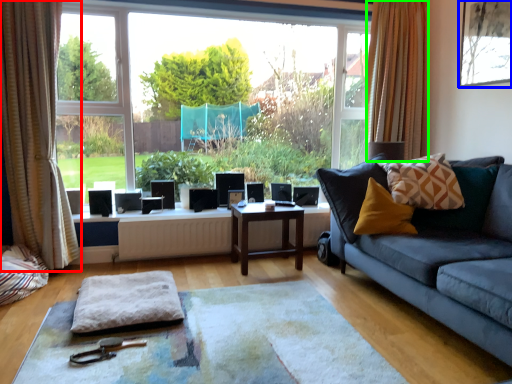
Question: Considering the real-world distances, which object is farthest from curtain (highlighted by a red box)? picture frame (highlighted by a blue box) or curtain (highlighted by a green box)?

Choices:
 (A) picture frame
 (B) curtain

Answer: (A)